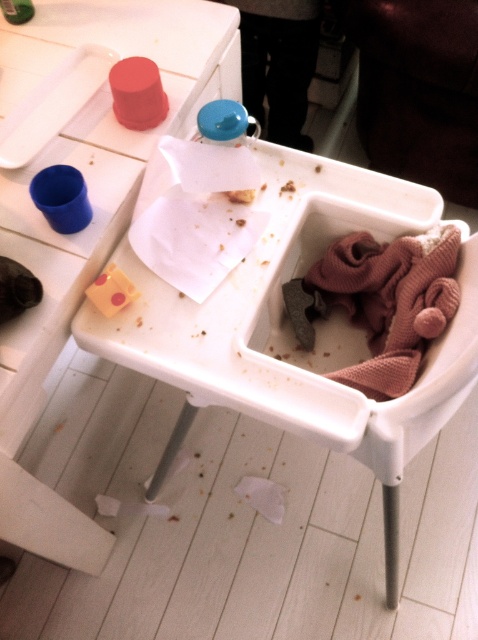
Question: Considering the real-world distances, which object is farthest from the white plastic tray at center?

Choices:
 (A) soft pink fabric at lower right
 (B) white plastic tray at upper left

Answer: (B)

Question: Does white plastic tray at upper left have a larger size compared to soft pink fabric at lower right?

Choices:
 (A) yes
 (B) no

Answer: (A)

Question: Which of the following is the farthest from the observer?

Choices:
 (A) yellow cheese slice at upper center
 (B) white plastic tray at upper left
 (C) soft pink fabric at lower right
 (D) white plastic tray at center

Answer: (A)

Question: Among these points, which one is farthest from the camera?

Choices:
 (A) (237, 189)
 (B) (402, 328)
 (C) (18, 93)

Answer: (C)

Question: Does white plastic tray at center appear on the left side of white plastic tray at upper left?

Choices:
 (A) yes
 (B) no

Answer: (B)

Question: Can you confirm if soft pink fabric at lower right is thinner than yellow cheese slice at upper center?

Choices:
 (A) yes
 (B) no

Answer: (B)